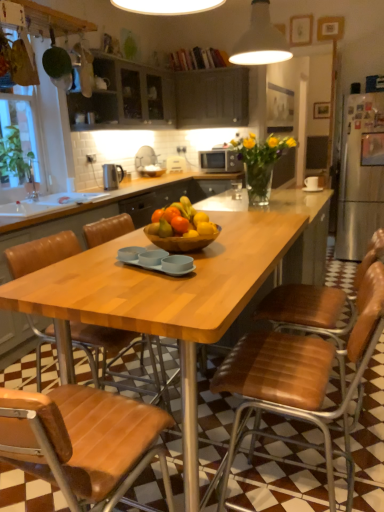
Where is `brown leather chair at lower left, the second chair from the right`? brown leather chair at lower left, the second chair from the right is located at coordinates (119, 357).

Describe the element at coordinates (112, 176) in the screenshot. I see `polished stainless steel kettle at upper left` at that location.

The height and width of the screenshot is (512, 384). In order to click on polished stainless steel kettle at upper left in this screenshot , I will do `click(112, 176)`.

The image size is (384, 512). Find the location of `matte silver microwave at center`. matte silver microwave at center is located at coordinates (220, 161).

You are a GUI agent. You are given a task and a screenshot of the screen. Output one action in this format:
    pyautogui.click(x=<x>, y=<y>)
    Task: Click on the brown leather chair at lower left, the second chair from the right
    
    Given the screenshot: What is the action you would take?
    pyautogui.click(x=119, y=357)

Is point (90, 327) closer or farther from the camera than point (253, 28)?

Point (90, 327).

Does brown leather chair at lower left, the second chair from the right, have a larger size compared to white matte lampshade at upper center?

Yes.

Which is more to the right, brown leather chair at lower left, placed as the first chair when sorted from left to right, or white matte lampshade at upper center?

From the viewer's perspective, white matte lampshade at upper center appears more on the right side.

Considering the relative sizes of white matte lampshade at upper center and wooden table at center in the image provided, is white matte lampshade at upper center thinner than wooden table at center?

Indeed, white matte lampshade at upper center has a lesser width compared to wooden table at center.

Can wooden table at center be found inside white matte lampshade at upper center?

No, wooden table at center is located outside of white matte lampshade at upper center.

Which is behind, point (265, 18) or point (43, 271)?

The point (265, 18) is farther.

Consider the image. Considering the relative sizes of white matte lampshade at upper center and wooden table at center in the image provided, is white matte lampshade at upper center shorter than wooden table at center?

Yes.

Is white matte lampshade at upper center outside of brown leather chair at lower left, the second chair from the right?

Yes, white matte lampshade at upper center is outside of brown leather chair at lower left, the second chair from the right.

Considering the relative sizes of white matte lampshade at upper center and brown leather chair at lower left, the second chair from the right, in the image provided, is white matte lampshade at upper center bigger than brown leather chair at lower left, the second chair from the right,?

No.

Considering the positions of point (271, 48) and point (87, 356), is point (271, 48) closer or farther from the camera than point (87, 356)?

Point (271, 48) is positioned farther from the camera compared to point (87, 356).

Is brown leather chair at center, marked as the 2th chair in a left-to-right arrangement, positioned in front of white glossy sink at lower left?

Yes.

Can you tell me how much brown leather chair at center, the 1th chair in the right-to-left sequence, and white glossy sink at lower left differ in facing direction?

The angle between the facing direction of brown leather chair at center, the 1th chair in the right-to-left sequence, and the facing direction of white glossy sink at lower left is 179 degrees.

Looking at this image, are brown leather chair at center, the 1th chair in the right-to-left sequence, and white glossy sink at lower left making contact?

No, brown leather chair at center, the 1th chair in the right-to-left sequence, is not touching white glossy sink at lower left.

From the image's perspective, is brown leather chair at center, marked as the 2th chair in a left-to-right arrangement, above white glossy sink at lower left?

No, from the image's perspective, brown leather chair at center, marked as the 2th chair in a left-to-right arrangement, is not above white glossy sink at lower left.

You are a GUI agent. You are given a task and a screenshot of the screen. Output one action in this format:
    pyautogui.click(x=<x>, y=<y>)
    Task: Click on the kitchen appliance that is below the matte gray cabinets at upper center, acting as the 2th cabinetry starting from the right (from the image's perspective)
    The width and height of the screenshot is (384, 512).
    Given the screenshot: What is the action you would take?
    pyautogui.click(x=220, y=161)

Based on their positions, is matte silver microwave at center located to the left or right of matte gray cabinets at upper center, the 1th cabinetry when ordered from left to right?

matte silver microwave at center is to the right of matte gray cabinets at upper center, the 1th cabinetry when ordered from left to right.

Is point (50, 213) less distant than point (273, 135)?

Yes.

Between white glossy sink at lower left and translucent glass vase at center, which one appears on the left side from the viewer's perspective?

white glossy sink at lower left is more to the left.

Is translucent glass vase at center at the back of white glossy sink at lower left?

That's not correct — white glossy sink at lower left is not looking away from translucent glass vase at center.

In order to click on sink on the left of translucent glass vase at center in this screenshot , I will do `click(49, 205)`.

From the white matte lampshade at upper center, count the 1st cabinetry to the left and point to it. Please provide its 2D coordinates.

[(212, 98)]

Is matte dark wood cabinets at upper center, the first cabinetry viewed from the right, turned away from white matte lampshade at upper center?

No, matte dark wood cabinets at upper center, the first cabinetry viewed from the right,'s orientation is not away from white matte lampshade at upper center.

Is matte dark wood cabinets at upper center, the first cabinetry viewed from the right, not near white matte lampshade at upper center?

Indeed, matte dark wood cabinets at upper center, the first cabinetry viewed from the right, is not near white matte lampshade at upper center.

Locate an element on the screen. This screenshot has width=384, height=512. light fixture that is behind the brown leather chair at lower left, the second chair from the right is located at coordinates (260, 40).

The image size is (384, 512). Find the location of `desk below the white matte lampshade at upper center (from the image's perspective)`. desk below the white matte lampshade at upper center (from the image's perspective) is located at coordinates (185, 289).

Based on their spatial positions, is white matte lampshade at upper center or brown leather chair at lower left, the second chair from the right, further from white glossy sink at lower left?

Based on the image, white matte lampshade at upper center appears to be further to white glossy sink at lower left.

Consider the image. Based on their spatial positions, is wooden table at center or translucent glass vase at center further from brown leather chair at lower left, placed as the first chair when sorted from left to right?

Based on the image, translucent glass vase at center appears to be further to brown leather chair at lower left, placed as the first chair when sorted from left to right.

Which object lies further to the anchor point brown leather chair at center, marked as the 2th chair in a left-to-right arrangement, matte silver microwave at center or white glossy sink at lower left?

matte silver microwave at center is further to brown leather chair at center, marked as the 2th chair in a left-to-right arrangement.

From the image, which object appears to be nearer to matte silver microwave at center, white glossy sink at lower left or white matte lampshade at upper center?

white matte lampshade at upper center.

Based on their spatial positions, is brown leather chair at lower left, the second chair from the right, or matte silver microwave at center closer to wooden table at center?

Among the two, brown leather chair at lower left, the second chair from the right, is located nearer to wooden table at center.

Considering their positions, is polished stainless steel kettle at upper left positioned closer to white matte lampshade at upper center than matte dark wood cabinets at upper center, the first cabinetry viewed from the right?

polished stainless steel kettle at upper left.

Estimate the real-world distances between objects in this image. Which object is closer to matte silver microwave at center, white matte lampshade at upper center or wooden table at center?

white matte lampshade at upper center.

Based on the photo, looking at the image, which one is located closer to brown leather chair at center, the 1th chair in the right-to-left sequence, matte gray cabinets at upper center, the 1th cabinetry when ordered from left to right, or white matte lampshade at upper center?

white matte lampshade at upper center is positioned closer to the anchor brown leather chair at center, the 1th chair in the right-to-left sequence.

You are a GUI agent. You are given a task and a screenshot of the screen. Output one action in this format:
    pyautogui.click(x=<x>, y=<y>)
    Task: Click on the flower positioned between wooden table at center and matte silver microwave at center from near to far
    
    Given the screenshot: What is the action you would take?
    pyautogui.click(x=260, y=163)

This screenshot has height=512, width=384. What are the coordinates of `cabinetry between translucent glass vase at center and polished stainless steel kettle at upper left in the front-back direction` in the screenshot? It's located at (161, 97).

Where is `appliance positioned between white matte lampshade at upper center and matte silver microwave at center from near to far`? The width and height of the screenshot is (384, 512). appliance positioned between white matte lampshade at upper center and matte silver microwave at center from near to far is located at coordinates (112, 176).

Find the location of a particular element. The image size is (384, 512). appliance positioned between wooden table at center and matte silver microwave at center from near to far is located at coordinates (112, 176).